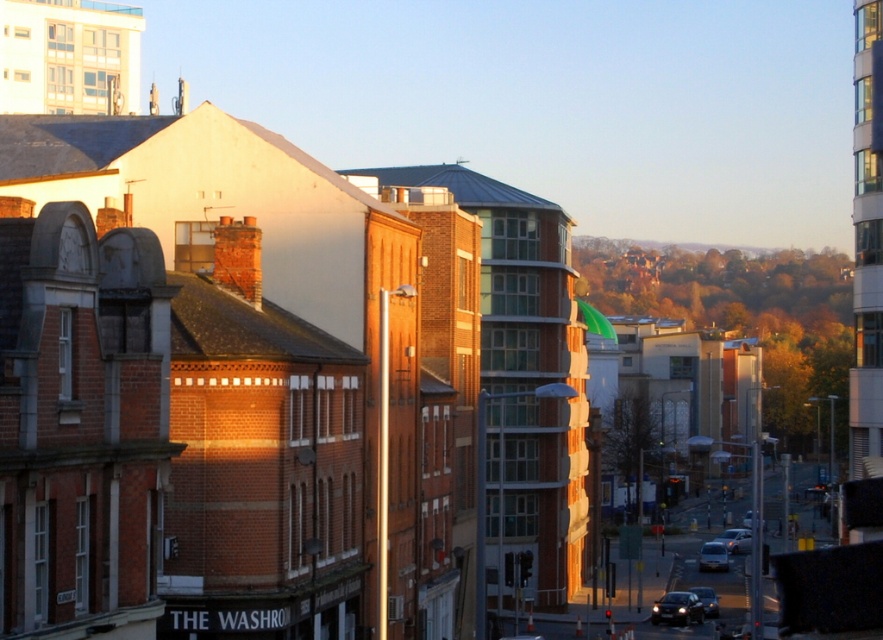
Question: Which object is farther from the camera taking this photo?

Choices:
 (A) shiny silver sedan at center
 (B) metallic silver car at center

Answer: (B)

Question: Observing the image, what is the correct spatial positioning of shiny black car at lower right in reference to metallic silver car at center?

Choices:
 (A) above
 (B) below

Answer: (A)

Question: Which of these objects is positioned farthest from the shiny silver sedan at center?

Choices:
 (A) metallic silver car at center
 (B) shiny black sedan at lower right

Answer: (B)

Question: Can you confirm if metallic silver car at center is positioned above shiny black sedan at lower right?

Choices:
 (A) yes
 (B) no

Answer: (B)

Question: Which object is farther from the camera taking this photo?

Choices:
 (A) metallic silver car at center
 (B) shiny black sedan at lower right
 (C) shiny silver sedan at center

Answer: (A)

Question: Is shiny silver sedan at center bigger than shiny black sedan at lower right?

Choices:
 (A) yes
 (B) no

Answer: (B)